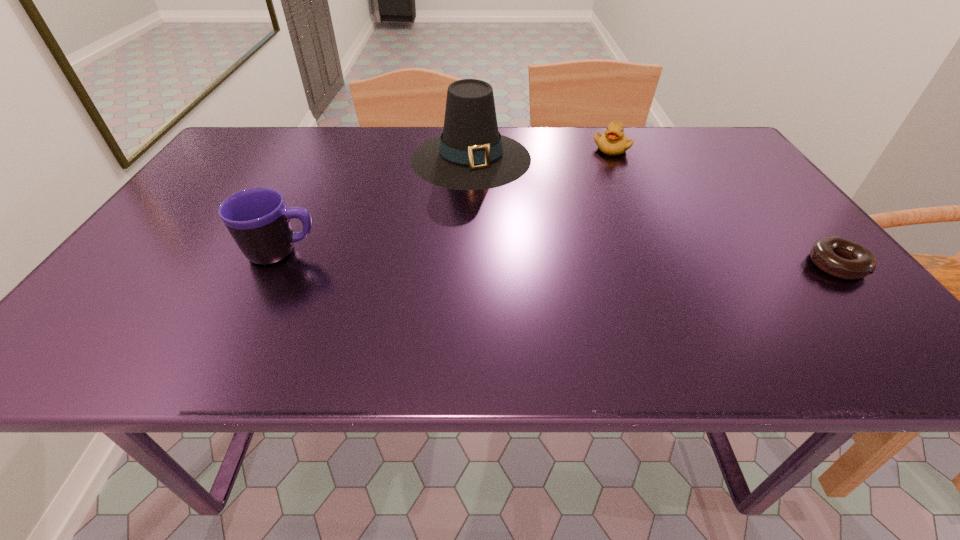
At what (x,y) coordinates should I click in order to perform the action: click on blank region between the second object from left to right and the rightmost object. Please return your answer as a coordinate pair (x, y). The width and height of the screenshot is (960, 540). Looking at the image, I should click on (654, 211).

The image size is (960, 540). I want to click on free area in between the mug and the second object from right to left, so click(x=447, y=200).

What are the coordinates of `vacant space that is in between the mug and the hat` in the screenshot? It's located at (377, 205).

Locate an element on the screen. Image resolution: width=960 pixels, height=540 pixels. free spot between the shortest object and the third object from right to left is located at coordinates (654, 211).

You are a GUI agent. You are given a task and a screenshot of the screen. Output one action in this format:
    pyautogui.click(x=<x>, y=<y>)
    Task: Click on the vacant point located between the mug and the shortest object
    
    Given the screenshot: What is the action you would take?
    pyautogui.click(x=559, y=259)

Identify which object is the second nearest to the shortest object. Please provide its 2D coordinates. Your answer should be formatted as a tuple, i.e. [(x, y)], where the tuple contains the x and y coordinates of a point satisfying the conditions above.

[(471, 154)]

The image size is (960, 540). I want to click on object identified as the second closest to the shortest object, so click(471, 154).

What are the coordinates of `free space that satisfies the following two spatial constraints: 1. on the front side of the rightmost object; 2. on the left side of the duckling` in the screenshot? It's located at (662, 265).